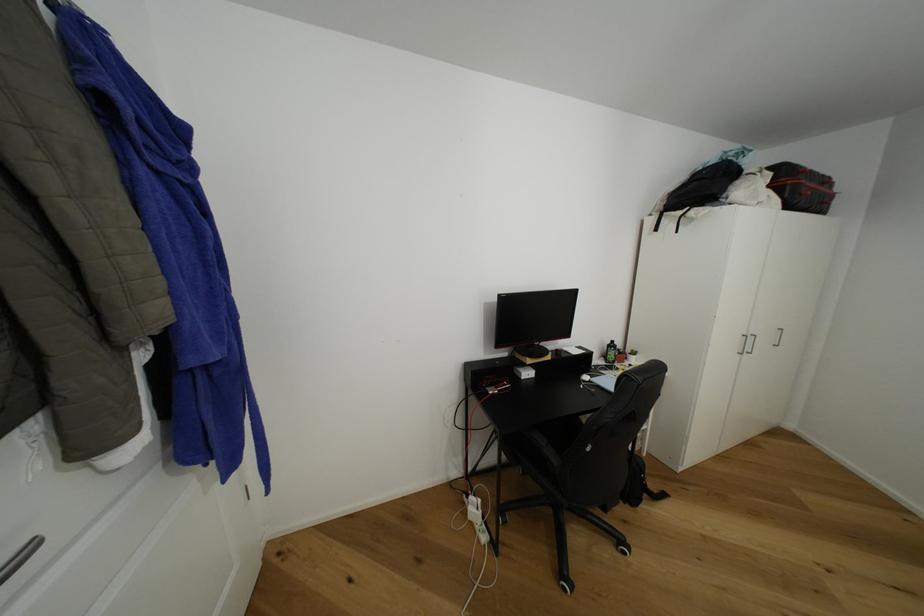
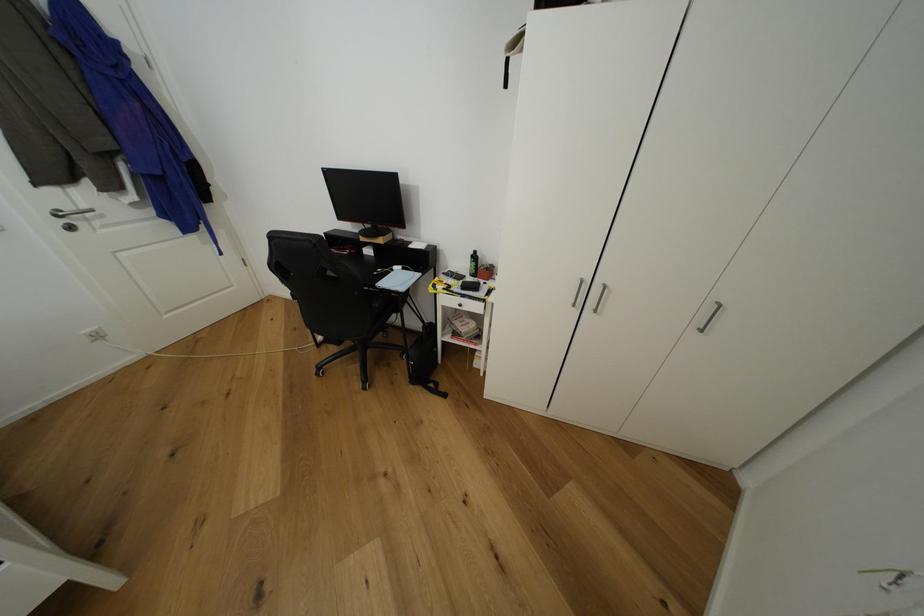
Locate, in the second image, the point that corresponds to (614,347) in the first image.

(478, 257)